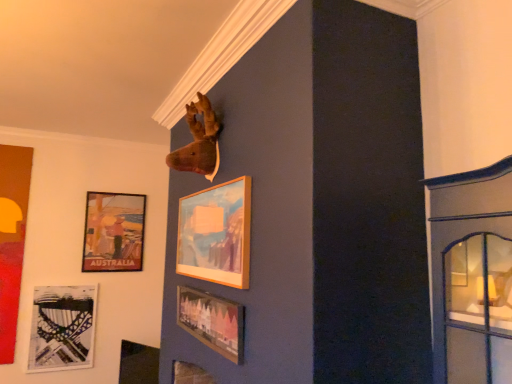
Question: Considering the relative sizes of matte black harp at lower left, which is counted as the second picture frame, starting from the back, and matte wooden picture frame at lower center, arranged as the 5th picture frame when viewed from the back, in the image provided, is matte black harp at lower left, which is counted as the second picture frame, starting from the back, thinner than matte wooden picture frame at lower center, arranged as the 5th picture frame when viewed from the back,?

Choices:
 (A) yes
 (B) no

Answer: (B)

Question: From a real-world perspective, is matte black harp at lower left, which is counted as the second picture frame, starting from the back, physically below matte wooden picture frame at lower center, which is the 1th picture frame from front to back?

Choices:
 (A) yes
 (B) no

Answer: (A)

Question: Does matte black harp at lower left, the 4th picture frame in the front-to-back sequence, come behind matte wooden picture frame at lower center, arranged as the 5th picture frame when viewed from the back?

Choices:
 (A) no
 (B) yes

Answer: (B)

Question: Can you confirm if matte black harp at lower left, which is counted as the second picture frame, starting from the back, is bigger than matte wooden picture frame at lower center, arranged as the 5th picture frame when viewed from the back?

Choices:
 (A) no
 (B) yes

Answer: (B)

Question: Considering the relative positions of matte black harp at lower left, the 4th picture frame in the front-to-back sequence, and matte wooden picture frame at lower center, which is the 1th picture frame from front to back, in the image provided, is matte black harp at lower left, the 4th picture frame in the front-to-back sequence, to the left of matte wooden picture frame at lower center, which is the 1th picture frame from front to back, from the viewer's perspective?

Choices:
 (A) no
 (B) yes

Answer: (B)

Question: Would you say matte black harp at lower left, which is counted as the second picture frame, starting from the back, is inside or outside wooden frame at upper center, the 2th picture frame viewed from the front?

Choices:
 (A) outside
 (B) inside

Answer: (A)

Question: From the image's perspective, relative to wooden frame at upper center, which appears as the 4th picture frame when viewed from the back, is matte black harp at lower left, the 4th picture frame in the front-to-back sequence, above or below?

Choices:
 (A) above
 (B) below

Answer: (B)

Question: From their relative heights in the image, would you say matte black harp at lower left, the 4th picture frame in the front-to-back sequence, is taller or shorter than wooden frame at upper center, the 2th picture frame viewed from the front?

Choices:
 (A) short
 (B) tall

Answer: (B)

Question: From a real-world perspective, is matte black harp at lower left, the 4th picture frame in the front-to-back sequence, above or below wooden frame at upper center, the 2th picture frame viewed from the front?

Choices:
 (A) above
 (B) below

Answer: (B)

Question: Based on their positions, is matte wooden picture frame at lower center, which is the 1th picture frame from front to back, located to the left or right of matte black harp at lower left, the 4th picture frame in the front-to-back sequence?

Choices:
 (A) left
 (B) right

Answer: (B)

Question: Relative to matte black harp at lower left, which is counted as the second picture frame, starting from the back, is matte wooden picture frame at lower center, arranged as the 5th picture frame when viewed from the back, in front or behind?

Choices:
 (A) front
 (B) behind

Answer: (A)

Question: Is matte wooden picture frame at lower center, which is the 1th picture frame from front to back, spatially inside matte black harp at lower left, which is counted as the second picture frame, starting from the back, or outside of it?

Choices:
 (A) inside
 (B) outside

Answer: (B)

Question: Is matte wooden picture frame at lower center, arranged as the 5th picture frame when viewed from the back, bigger or smaller than matte black harp at lower left, the 4th picture frame in the front-to-back sequence?

Choices:
 (A) big
 (B) small

Answer: (B)

Question: In the image, is matte black harp at lower left, which is counted as the second picture frame, starting from the back, on the left side or the right side of matte wooden picture frame at lower center, arranged as the 5th picture frame when viewed from the back?

Choices:
 (A) right
 (B) left

Answer: (B)

Question: From the image's perspective, is matte black harp at lower left, the 4th picture frame in the front-to-back sequence, located above or below matte wooden picture frame at lower center, which is the 1th picture frame from front to back?

Choices:
 (A) above
 (B) below

Answer: (B)